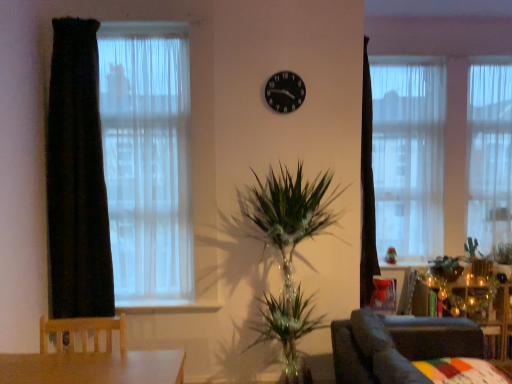
Find the location of a particular element. The image size is (512, 384). free space underneath white sheer curtain at left (from a real-world perspective) is located at coordinates (144, 297).